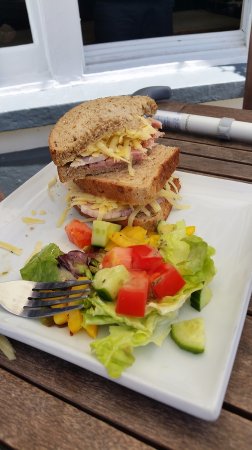
This screenshot has width=252, height=450. I want to click on window, so click(x=11, y=66), click(x=136, y=19).